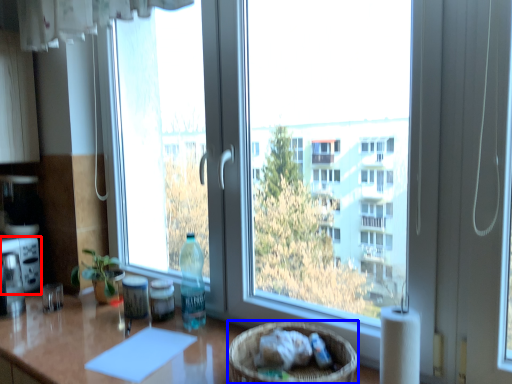
Question: Which object is further to the camera taking this photo, appliance (highlighted by a red box) or basket (highlighted by a blue box)?

Choices:
 (A) appliance
 (B) basket

Answer: (A)